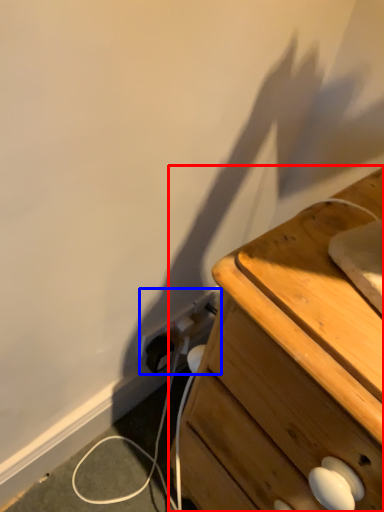
Question: Which of the following is the farthest to the observer, chest of drawers (highlighted by a red box) or electric outlet (highlighted by a blue box)?

Choices:
 (A) chest of drawers
 (B) electric outlet

Answer: (B)